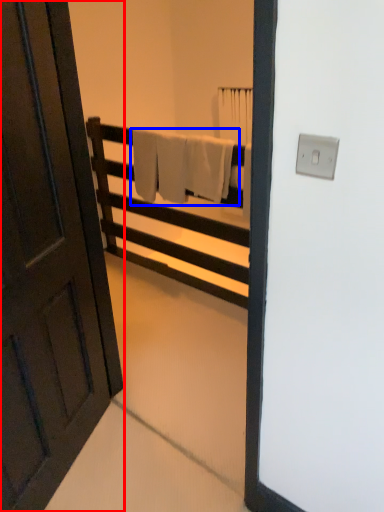
Question: Among these objects, which one is nearest to the camera, door (highlighted by a red box) or bath towel (highlighted by a blue box)?

Choices:
 (A) door
 (B) bath towel

Answer: (A)